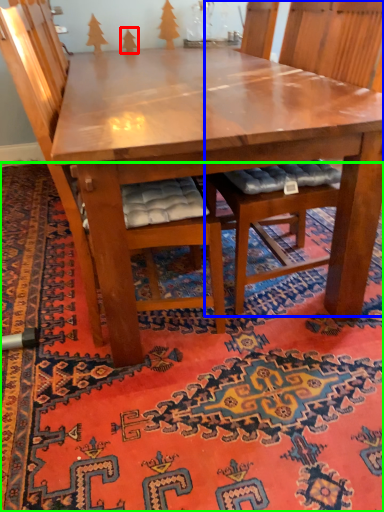
Question: Which is nearer to the tree (highlighted by a red box)? chair (highlighted by a blue box) or mat (highlighted by a green box).

Choices:
 (A) chair
 (B) mat

Answer: (A)